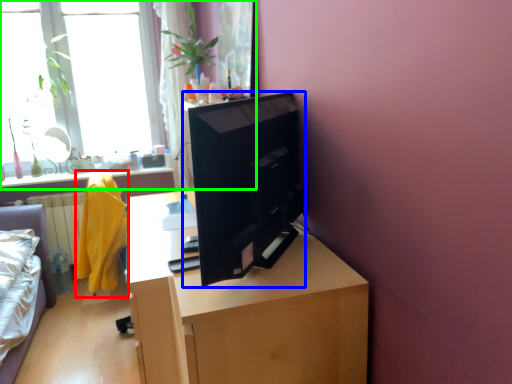
Question: Based on their relative distances, which object is nearer to robe (highlighted by a red box)? Choose from computer (highlighted by a blue box) and window (highlighted by a green box).

Choices:
 (A) computer
 (B) window

Answer: (B)